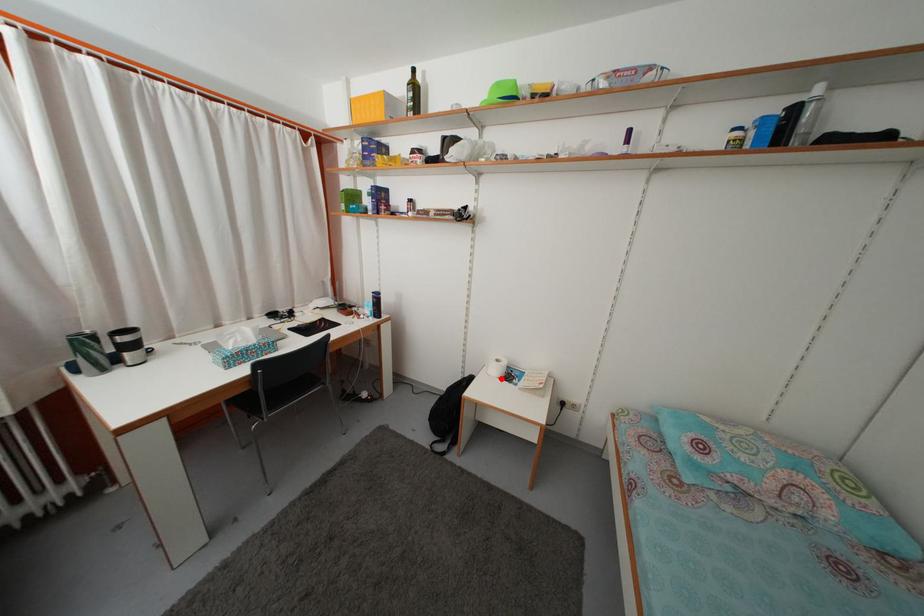
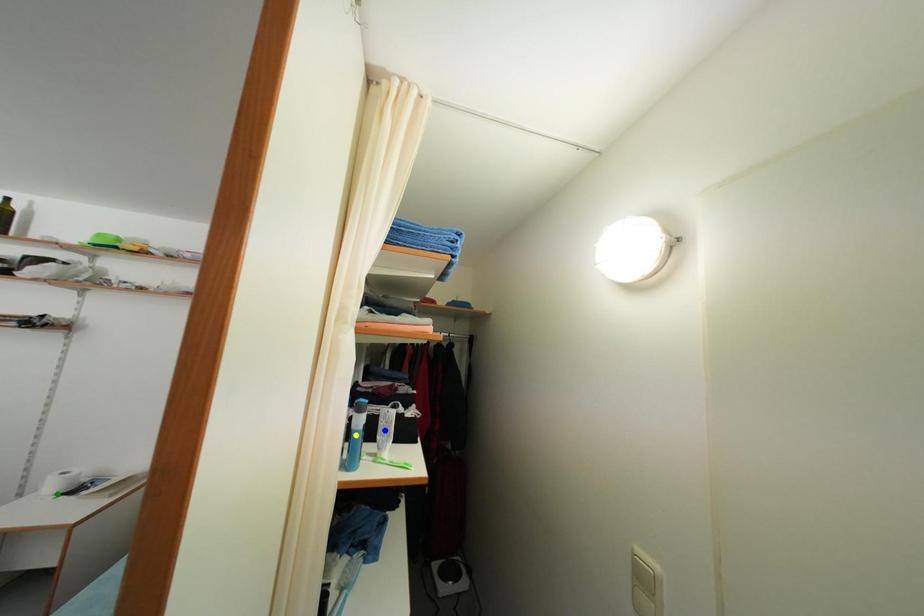
Question: I am providing you with two images of the same scene from different viewpoints. A red point is marked on the first image. You are given multiple points on the second image. Which spot in image 2 lines up with the point in image 1?

Choices:
 (A) blue point
 (B) green point
 (C) yellow point

Answer: (B)